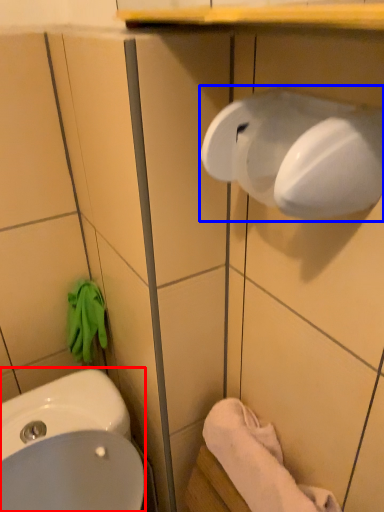
Question: Which object is closer to the camera taking this photo, sink (highlighted by a red box) or hand dryer (highlighted by a blue box)?

Choices:
 (A) sink
 (B) hand dryer

Answer: (B)